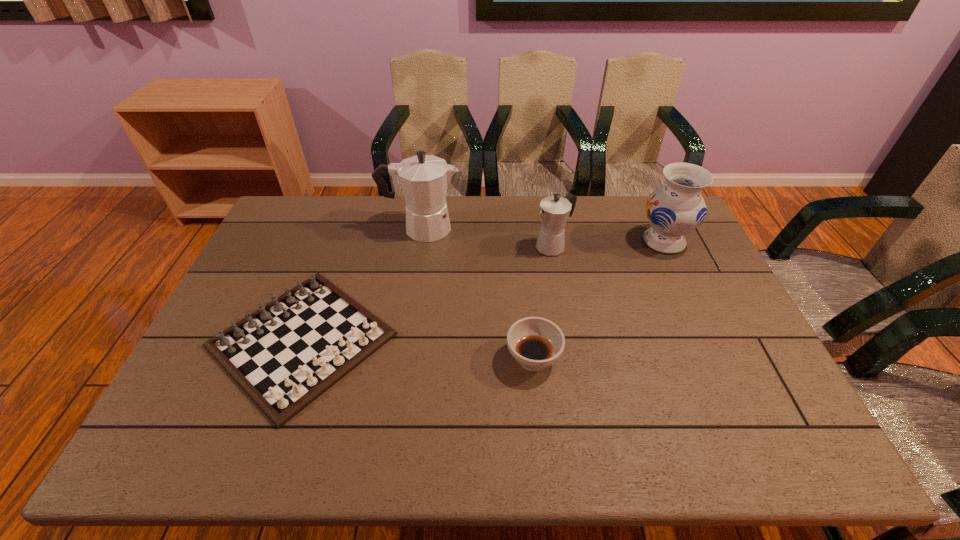
Locate an element on the screen. This screenshot has height=540, width=960. free space at the right edge is located at coordinates (711, 327).

The height and width of the screenshot is (540, 960). In the image, there is a desktop. In order to click on vacant space at the far left corner in this screenshot , I will do `click(283, 210)`.

Where is `free point at the near left corner`? The width and height of the screenshot is (960, 540). free point at the near left corner is located at coordinates (209, 457).

The image size is (960, 540). What are the coordinates of `vacant area that lies between the taller coffeepot and the shorter coffeepot` in the screenshot? It's located at (487, 237).

I want to click on free space between the third shortest object and the rightmost object, so click(x=608, y=244).

What are the coordinates of `unoccupied area between the taller coffeepot and the soup bowl` in the screenshot? It's located at (477, 293).

Where is `free spot between the soup bowl and the chessboard`? This screenshot has height=540, width=960. free spot between the soup bowl and the chessboard is located at coordinates (418, 349).

The width and height of the screenshot is (960, 540). I want to click on vacant space that's between the soup bowl and the chessboard, so click(418, 349).

Where is `unoccupied position between the shortest object and the shorter coffeepot`? This screenshot has width=960, height=540. unoccupied position between the shortest object and the shorter coffeepot is located at coordinates coord(427,293).

Identify the location of unoccupied position between the third shortest object and the taller coffeepot. Image resolution: width=960 pixels, height=540 pixels. (487, 237).